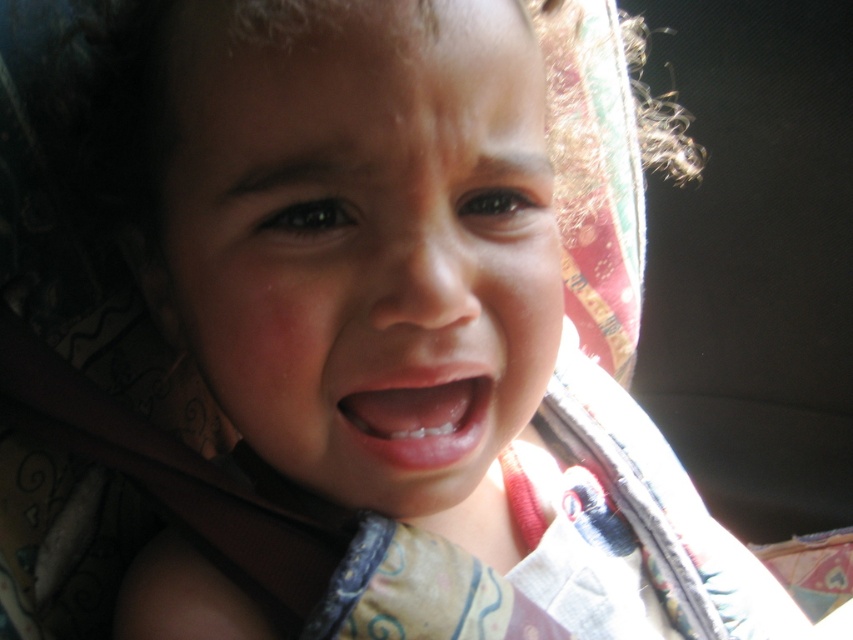
What do you see at coordinates (364, 241) in the screenshot? I see `smooth skin face at center` at bounding box center [364, 241].

Is point (283, 360) positioned before point (387, 404)?

Yes, it is.

Does point (351, 168) come in front of point (471, 442)?

Yes, it is in front of point (471, 442).

Locate an element on the screen. This screenshot has height=640, width=853. smooth skin face at center is located at coordinates (364, 241).